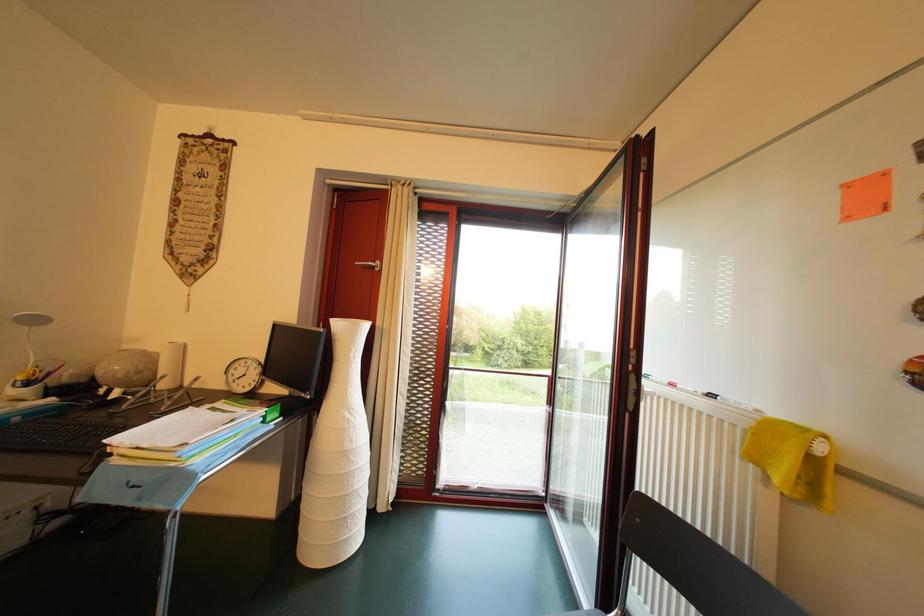
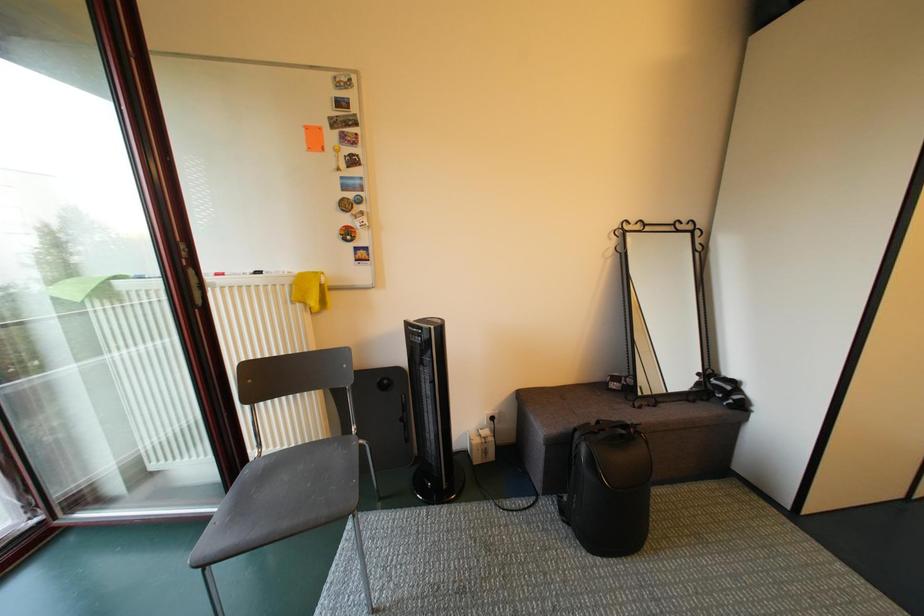
First-person continuous shooting, in which direction is the camera rotating?

The camera rotated toward right-down.